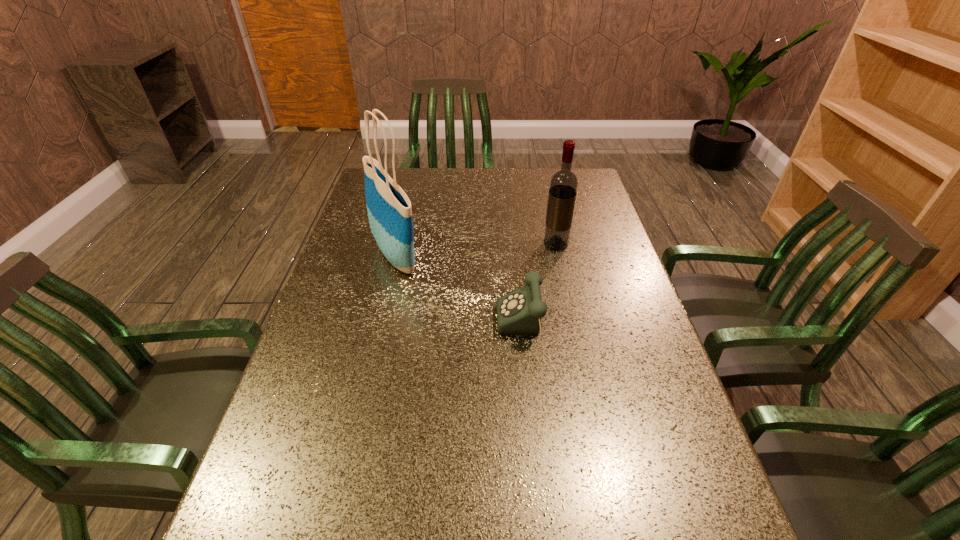
This screenshot has width=960, height=540. I want to click on vacant area that lies between the telephone and the tote bag, so click(462, 293).

Image resolution: width=960 pixels, height=540 pixels. In order to click on free spot between the telephone and the leftmost object in this screenshot , I will do (x=462, y=293).

The height and width of the screenshot is (540, 960). What are the coordinates of `unoccupied position between the second object from left to right and the second shortest object` in the screenshot? It's located at (541, 288).

Where is `free space between the shortest object and the tote bag`? The height and width of the screenshot is (540, 960). free space between the shortest object and the tote bag is located at coordinates [462, 293].

Identify which object is the closest to the wine bottle. Please provide its 2D coordinates. Your answer should be formatted as a tuple, i.e. [(x, y)], where the tuple contains the x and y coordinates of a point satisfying the conditions above.

[(519, 312)]

Identify which object is located as the second nearest to the leftmost object. Please provide its 2D coordinates. Your answer should be formatted as a tuple, i.e. [(x, y)], where the tuple contains the x and y coordinates of a point satisfying the conditions above.

[(563, 187)]